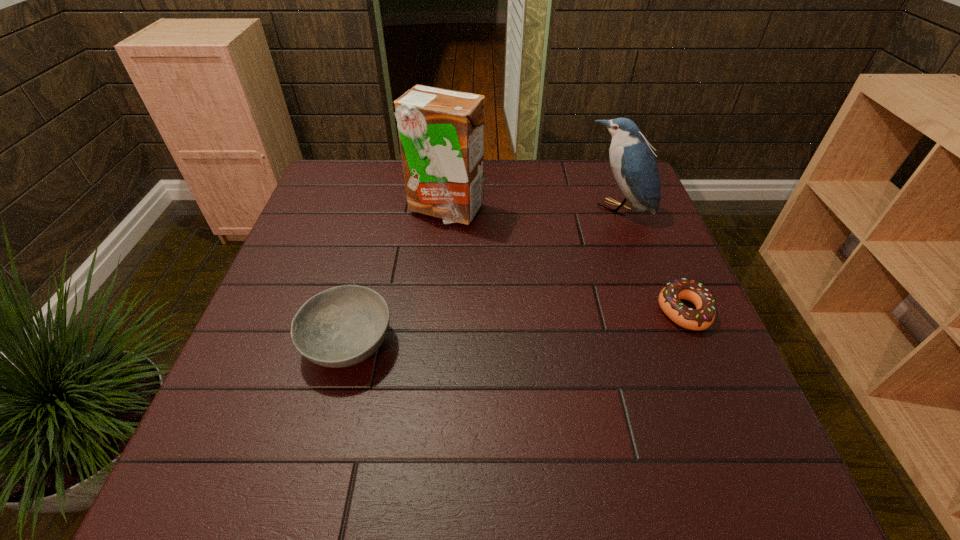
Locate an element on the screen. Image resolution: width=960 pixels, height=540 pixels. bowl is located at coordinates (342, 326).

Identify the location of doughnut. The height and width of the screenshot is (540, 960). (701, 318).

Locate an element on the screen. the second tallest object is located at coordinates (632, 160).

Locate an element on the screen. The width and height of the screenshot is (960, 540). the tallest object is located at coordinates (441, 132).

This screenshot has width=960, height=540. Identify the location of vacant space located 0.060m on the front of the second shortest object. (330, 413).

The width and height of the screenshot is (960, 540). I want to click on vacant space located on the left of the shortest object, so click(518, 312).

At what (x,y) coordinates should I click in order to perform the action: click on vacant space located at the tip of the bird's beak. Please return your answer as a coordinate pair (x, y). This screenshot has width=960, height=540. Looking at the image, I should click on (568, 254).

I want to click on vacant space located 0.200m at the tip of the bird's beak, so click(x=562, y=260).

Identify the location of free point located 0.080m at the tip of the bird's beak. (587, 237).

I want to click on blank space located on the straw side of the tallest object, so click(x=488, y=285).